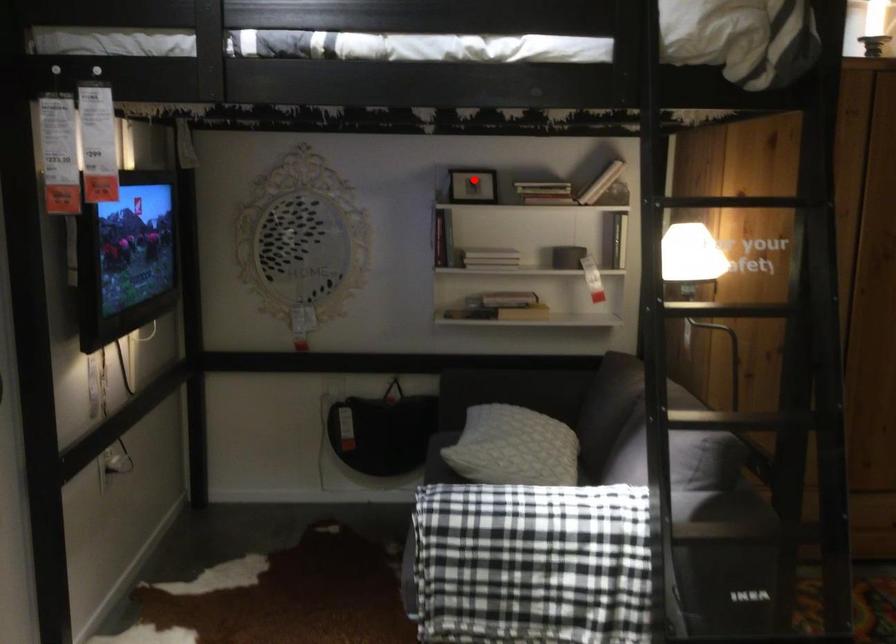
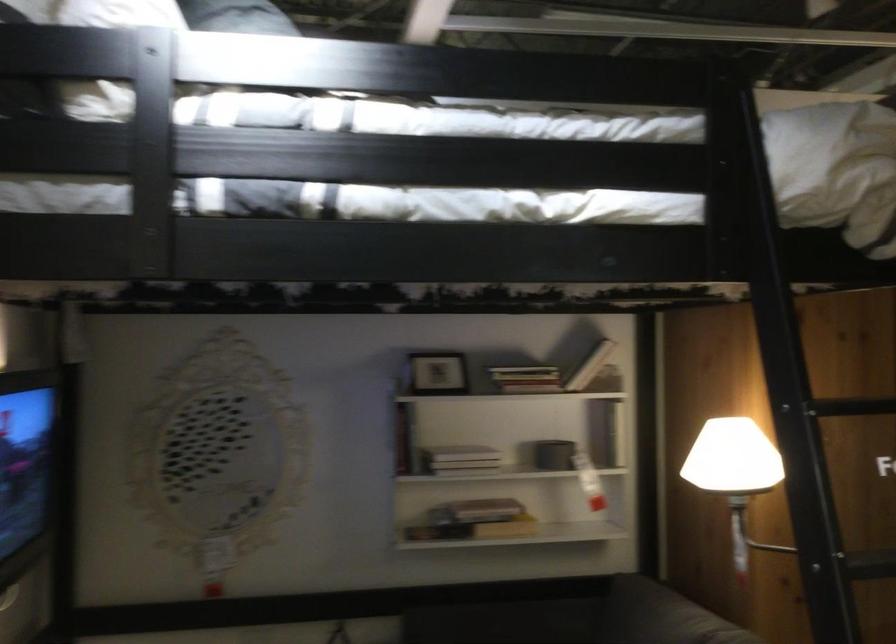
Where in the second image is the point corresponding to the highlighted location from the first image?

(437, 373)